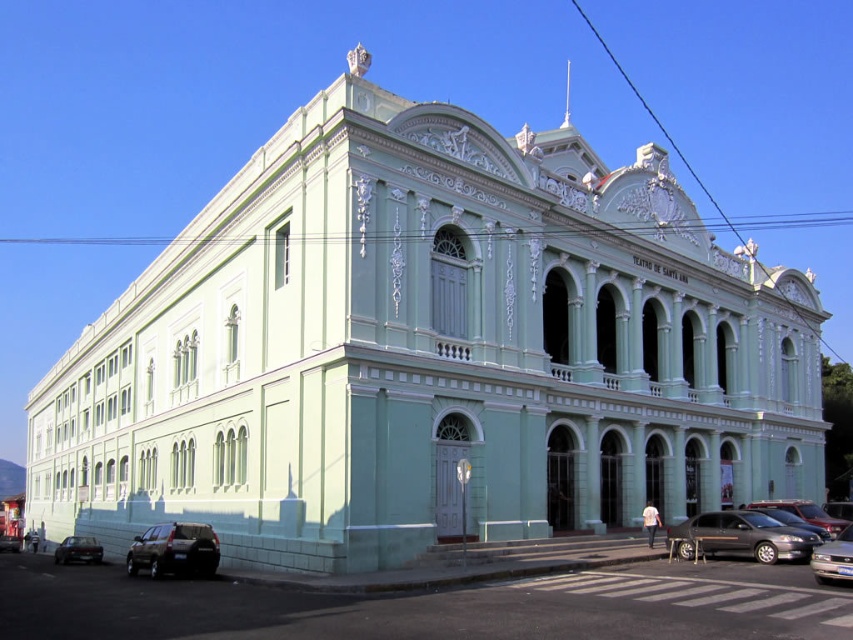
You are a pedestrian standing in front of the grand pastel green building. You see a shiny black suv at lower left and a shiny black car at lower left. Which vehicle is positioned higher from the ground?

The shiny black suv at lower left is above the shiny black car at lower left, so the shiny black suv at lower left is positioned higher from the ground.

You are a delivery person needing to park a delivery van that is 2.5 meters wide. You see a shiny black suv at lower left and a shiny black car at lower left in the parking area. Can your van fit between them if they are parked side by side?

The shiny black suv at lower left has a lesser width compared to shiny black car at lower left. The combined width of both vehicles would be the sum of their individual widths. Since the suv is narrower, but without exact measurements, it is uncertain if the total space between them allows for a 2.5 meter wide van. Additional information about the spacing between the vehicles is needed to determine feasibility.

You are a pedestrian standing in front of the grand pastel green building. You see a shiny black suv at lower left and a shiny black car at lower left. Which vehicle is closer to the entrance of the building?

The shiny black car at lower left is closer to the entrance of the building because the shiny black suv at lower left is to the right of it, meaning the car is positioned more to the left near the entrance.